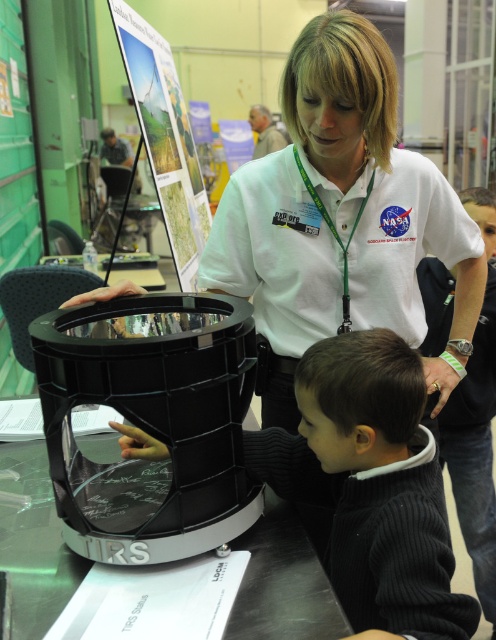
Who is positioned more to the left, white smooth shirt at center or dark gray ribbed sweater at lower center?

dark gray ribbed sweater at lower center

The width and height of the screenshot is (496, 640). Describe the element at coordinates (342, 218) in the screenshot. I see `white smooth shirt at center` at that location.

Find the location of a particular element. This screenshot has height=640, width=496. white smooth shirt at center is located at coordinates [x=342, y=218].